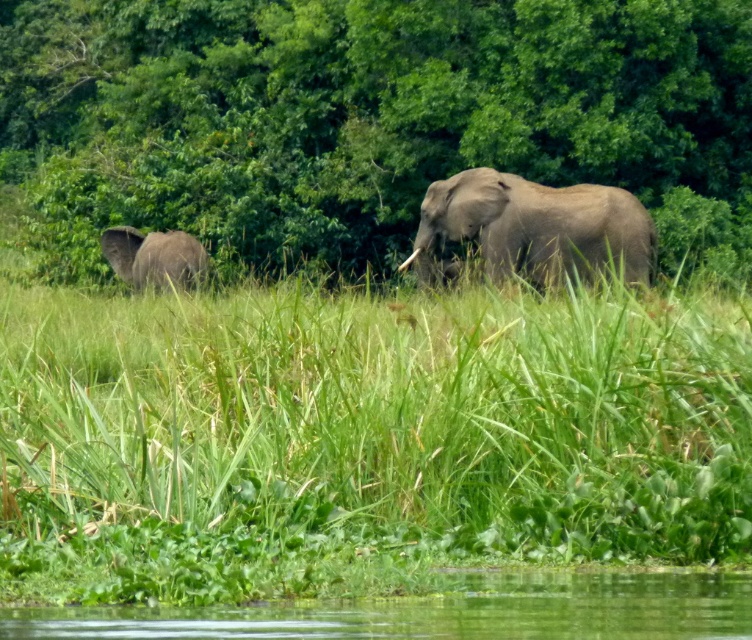
Who is lower down, gray matte elephant at center or white ivory tusk at center?

Positioned lower is white ivory tusk at center.

Between point (519, 252) and point (420, 252), which one is positioned behind?

Positioned behind is point (420, 252).

Measure the distance between point (584, 228) and camera.

Point (584, 228) is 83.74 feet from camera.

Locate an element on the screen. The height and width of the screenshot is (640, 752). gray matte elephant at center is located at coordinates (532, 227).

The image size is (752, 640). Describe the element at coordinates (153, 257) in the screenshot. I see `gray matte elephant at left` at that location.

Describe the element at coordinates (153, 257) in the screenshot. The width and height of the screenshot is (752, 640). I see `gray matte elephant at left` at that location.

Locate an element on the screen. gray matte elephant at left is located at coordinates (153, 257).

In the scene shown: Measure the distance from green leafy trees at center to gray matte elephant at left.

They are 4.21 meters apart.

Is green leafy trees at center taller than gray matte elephant at left?

Correct, green leafy trees at center is much taller as gray matte elephant at left.

Identify the location of green leafy trees at center. The height and width of the screenshot is (640, 752). (367, 118).